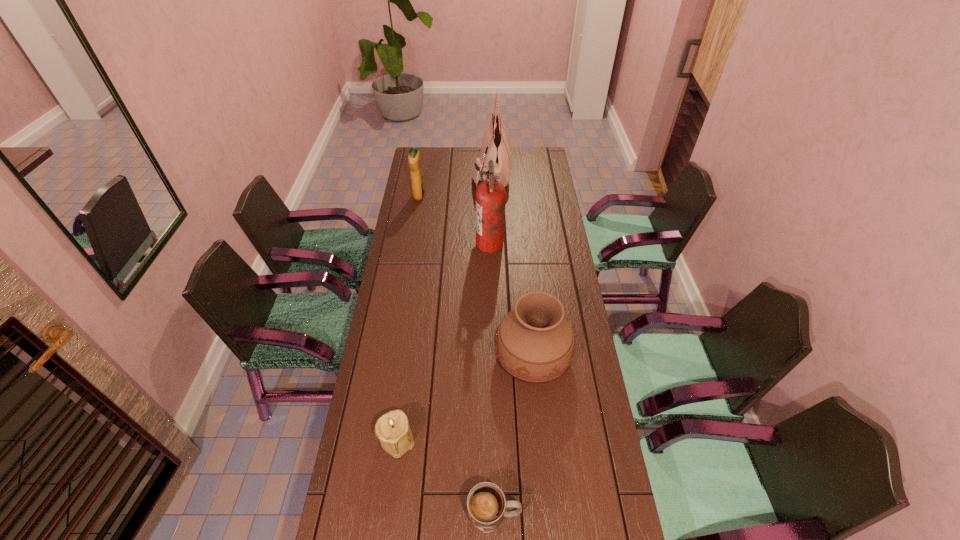
The height and width of the screenshot is (540, 960). I want to click on handbag, so click(x=495, y=146).

Find the location of a particular element. fire extinguisher is located at coordinates (490, 194).

I want to click on detergent, so click(418, 190).

At what (x,y) coordinates should I click in order to perform the action: click on urn. Please return your answer as a coordinate pair (x, y). This screenshot has width=960, height=540. Looking at the image, I should click on (534, 342).

Where is `candle_holder`? The width and height of the screenshot is (960, 540). candle_holder is located at coordinates (392, 429).

Identify the location of the fifth tallest object. (392, 429).

Where is `the nearest object`? The height and width of the screenshot is (540, 960). the nearest object is located at coordinates (486, 504).

This screenshot has height=540, width=960. Identify the location of mug. (486, 504).

Where is `vacant area situated 0.140m on the side of the handbag with the attached pouch`? Image resolution: width=960 pixels, height=540 pixels. vacant area situated 0.140m on the side of the handbag with the attached pouch is located at coordinates (445, 172).

Identify the location of free location located 0.120m on the side of the handbag with the attached pouch. The width and height of the screenshot is (960, 540). (449, 172).